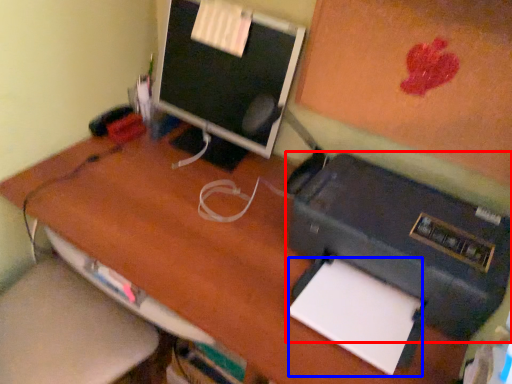
Question: Among these objects, which one is nearest to the camera, printer (highlighted by a red box) or notepad (highlighted by a blue box)?

Choices:
 (A) printer
 (B) notepad

Answer: (A)